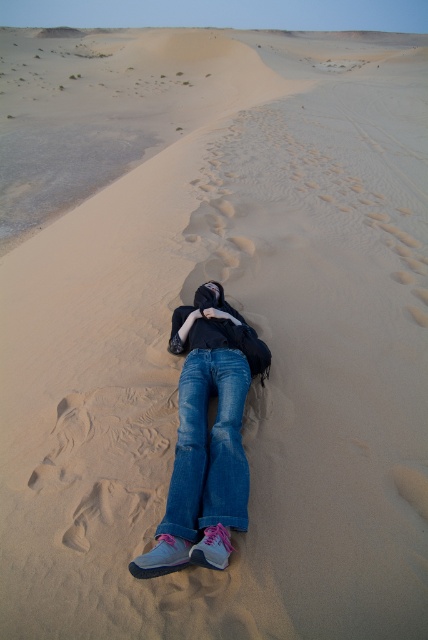
Who is lower down, blue denim jeans at center or denim at center?

denim at center is lower down.

Is point (196, 500) behind point (171, 502)?

That is True.

Where is `blue denim jeans at center`? blue denim jeans at center is located at coordinates (207, 440).